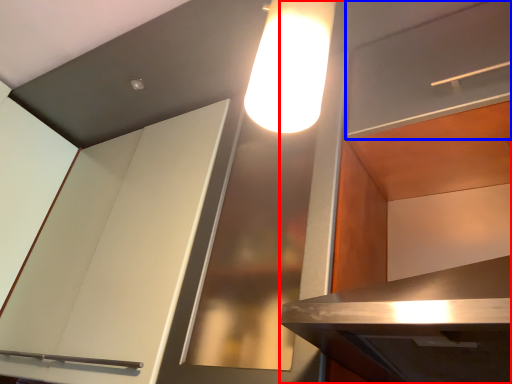
Question: Which of the following is the farthest to the observer, cabinetry (highlighted by a red box) or shelf (highlighted by a blue box)?

Choices:
 (A) cabinetry
 (B) shelf

Answer: (B)